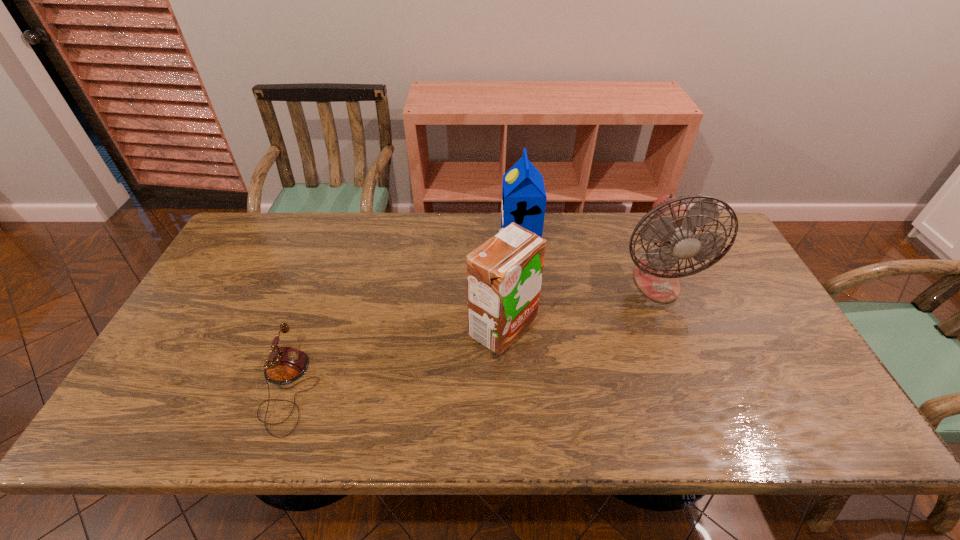
At what (x,y) coordinates should I click in order to perform the action: click on object that is the second closest to the farther carton. Please return your answer as a coordinate pair (x, y). Looking at the image, I should click on (504, 275).

Where is `the closest object to the fan`? the closest object to the fan is located at coordinates (524, 198).

Where is `free space that satisfies the following two spatial constraints: 1. in front of the rightmost object to direct airflow; 2. on the straw side of the nearer carton`? The image size is (960, 540). free space that satisfies the following two spatial constraints: 1. in front of the rightmost object to direct airflow; 2. on the straw side of the nearer carton is located at coordinates (675, 328).

Locate an element on the screen. free point that satisfies the following two spatial constraints: 1. in front of the rightmost object to direct airflow; 2. on the straw side of the nearer carton is located at coordinates (675, 328).

Find the location of `free space that satisfies the following two spatial constraints: 1. in front of the fan to direct airflow; 2. on the straw side of the nearer carton`. free space that satisfies the following two spatial constraints: 1. in front of the fan to direct airflow; 2. on the straw side of the nearer carton is located at coordinates (675, 328).